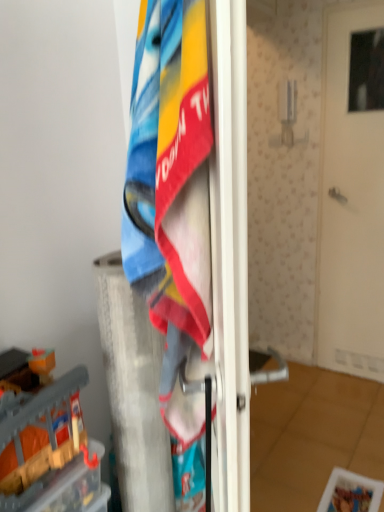
Question: Is white matte door at center in front of white textured pillar at center?

Choices:
 (A) no
 (B) yes

Answer: (A)

Question: From a real-world perspective, is white matte door at center located higher than white textured pillar at center?

Choices:
 (A) yes
 (B) no

Answer: (A)

Question: Is white matte door at center in contact with white textured pillar at center?

Choices:
 (A) yes
 (B) no

Answer: (B)

Question: Considering the relative sizes of white matte door at center and white textured pillar at center in the image provided, is white matte door at center taller than white textured pillar at center?

Choices:
 (A) no
 (B) yes

Answer: (B)

Question: Considering the relative sizes of white matte door at center and white textured pillar at center in the image provided, is white matte door at center smaller than white textured pillar at center?

Choices:
 (A) yes
 (B) no

Answer: (B)

Question: Does white matte door at center have a larger size compared to white textured pillar at center?

Choices:
 (A) yes
 (B) no

Answer: (A)

Question: Is white textured pillar at center facing towards wooden block at left?

Choices:
 (A) yes
 (B) no

Answer: (B)

Question: Can you confirm if white textured pillar at center is bigger than wooden block at left?

Choices:
 (A) no
 (B) yes

Answer: (B)

Question: Can you confirm if white textured pillar at center is thinner than wooden block at left?

Choices:
 (A) yes
 (B) no

Answer: (A)

Question: Does white textured pillar at center have a greater height compared to wooden block at left?

Choices:
 (A) yes
 (B) no

Answer: (A)

Question: Does white textured pillar at center appear on the right side of wooden block at left?

Choices:
 (A) yes
 (B) no

Answer: (A)

Question: Is white textured pillar at center positioned far away from wooden block at left?

Choices:
 (A) no
 (B) yes

Answer: (A)

Question: Is textured cotton towel at center wider than white textured pillar at center?

Choices:
 (A) no
 (B) yes

Answer: (A)